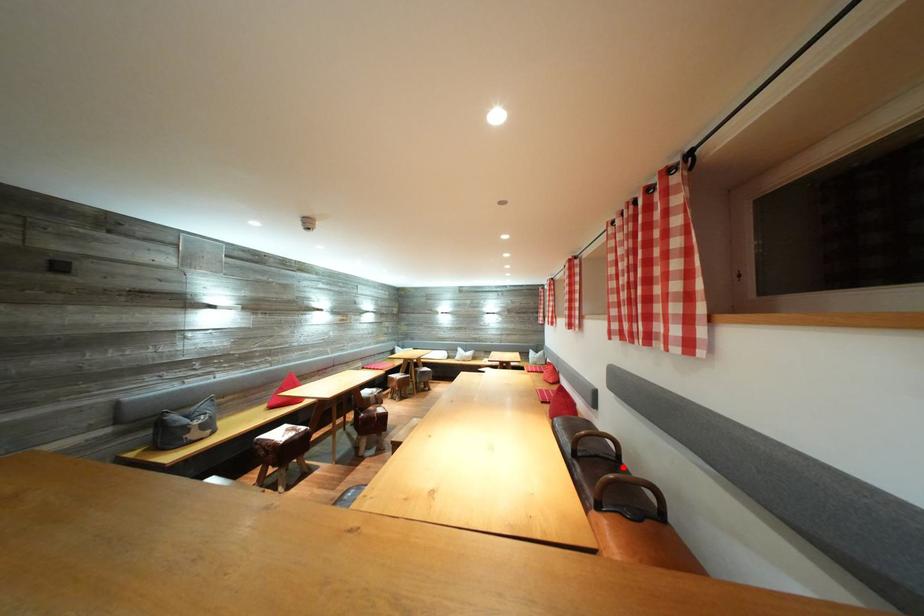
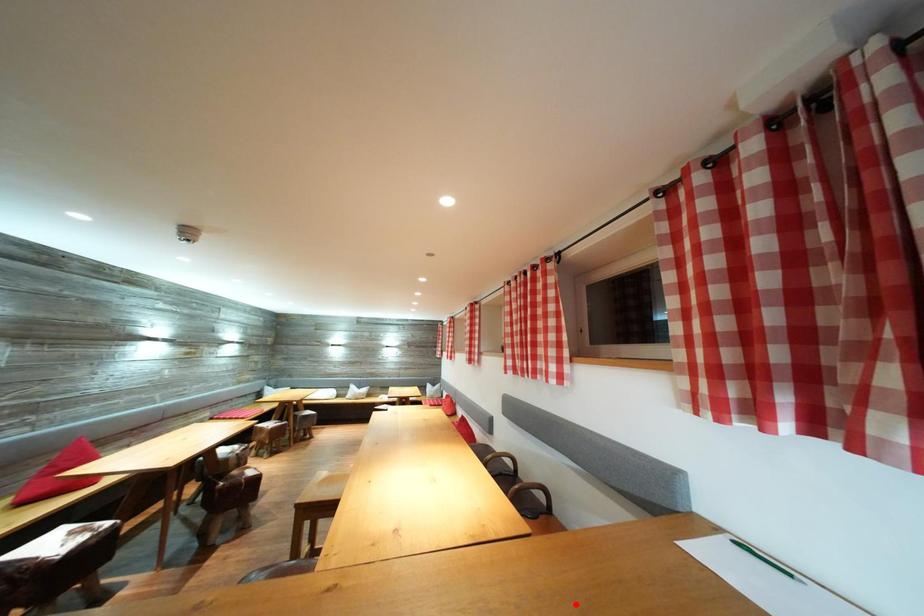
I am providing you with two images of the same scene from different viewpoints. A red point is marked on the first image and another point is marked on the second image. Are the points marked in image1 and image2 representing the same 3D position?

No